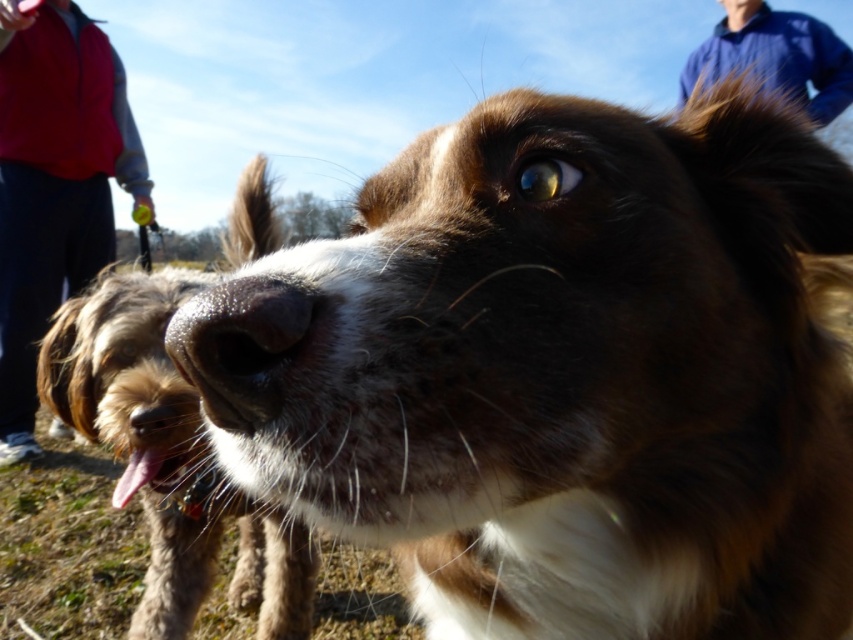
You are standing at the position of the red fleece jacket at left and want to throw a ball to the brown fuzzy dog at center. If the ball travels in a straight line, how far will it have to travel to reach the dog?

The brown fuzzy dog at center is 2.19 meters away from the red fleece jacket at left, so the ball will have to travel 2.19 meters to reach the dog.